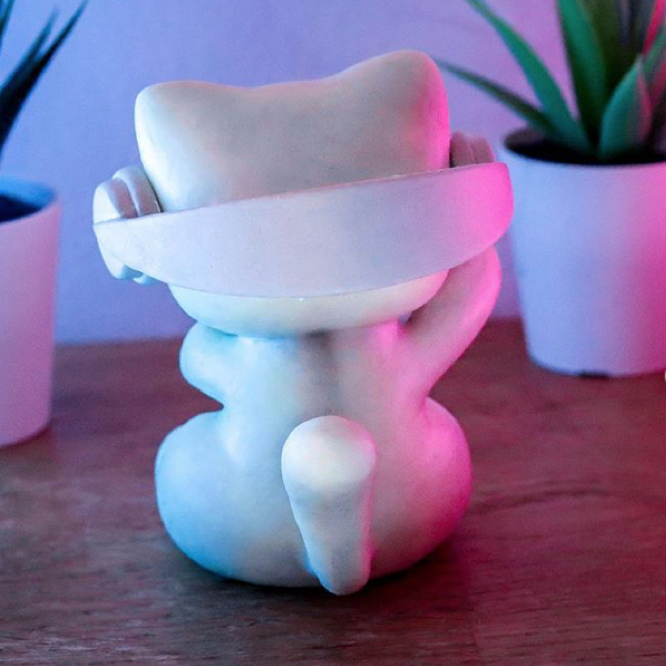
This screenshot has width=666, height=666. I want to click on figurine, so click(300, 361).